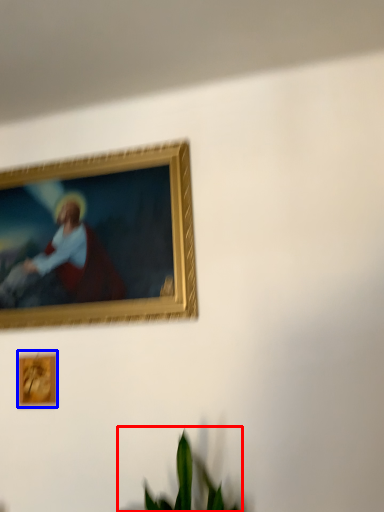
Question: Which of the following is the farthest to the observer, houseplant (highlighted by a red box) or picture frame (highlighted by a blue box)?

Choices:
 (A) houseplant
 (B) picture frame

Answer: (B)